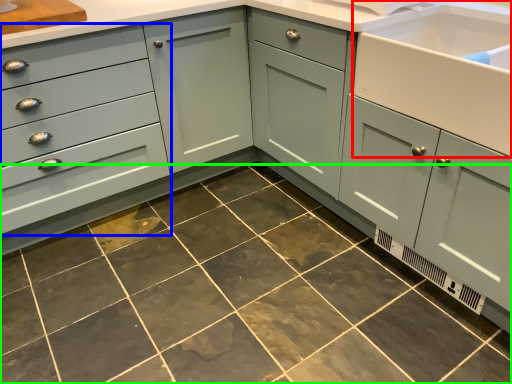
Question: Which object is the farthest from sink (highlighted by a red box)? Choose among these: drawer (highlighted by a blue box) or ceramic tile (highlighted by a green box).

Choices:
 (A) drawer
 (B) ceramic tile

Answer: (A)